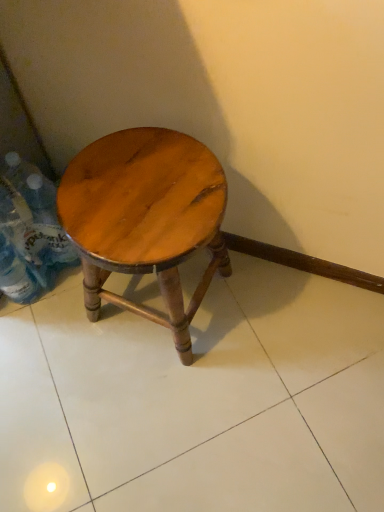
Question: From a real-world perspective, is wooden stool at center physically located above or below translucent plastic bottle at left?

Choices:
 (A) above
 (B) below

Answer: (A)

Question: Is point (208, 212) positioned closer to the camera than point (8, 227)?

Choices:
 (A) farther
 (B) closer

Answer: (B)

Question: In the image, is wooden stool at center on the left side or the right side of translucent plastic bottle at left?

Choices:
 (A) left
 (B) right

Answer: (B)

Question: In terms of height, does translucent plastic bottle at left look taller or shorter compared to wooden stool at center?

Choices:
 (A) tall
 (B) short

Answer: (B)

Question: Would you say translucent plastic bottle at left is to the left or to the right of wooden stool at center in the picture?

Choices:
 (A) right
 (B) left

Answer: (B)

Question: Is translucent plastic bottle at left inside the boundaries of wooden stool at center, or outside?

Choices:
 (A) outside
 (B) inside

Answer: (A)

Question: From a real-world perspective, is translucent plastic bottle at left positioned above or below wooden stool at center?

Choices:
 (A) below
 (B) above

Answer: (A)